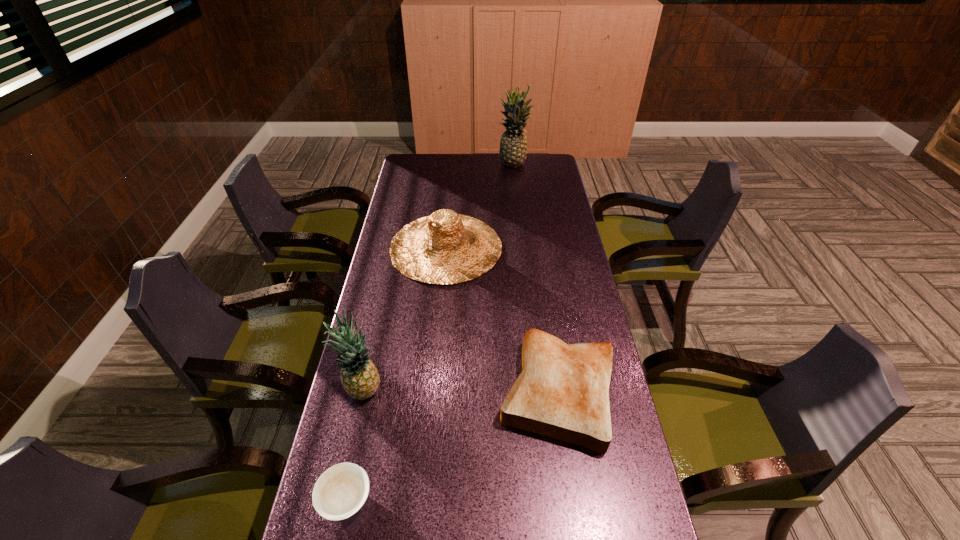
In order to click on the right pineapple in this screenshot , I will do `click(513, 146)`.

I want to click on the farther pineapple, so click(513, 146).

Locate an element on the screen. the second tallest object is located at coordinates (360, 379).

This screenshot has height=540, width=960. Find the location of `the shorter pineapple`. the shorter pineapple is located at coordinates (360, 379).

This screenshot has width=960, height=540. What are the coordinates of `the fourth nearest object` in the screenshot? It's located at (444, 248).

At what (x,y) coordinates should I click in order to perform the action: click on sunhat. Please return your answer as a coordinate pair (x, y). The height and width of the screenshot is (540, 960). Looking at the image, I should click on (444, 248).

You are a GUI agent. You are given a task and a screenshot of the screen. Output one action in this format:
    pyautogui.click(x=<x>, y=<y>)
    Task: Click on the bread
    This screenshot has width=960, height=540.
    Given the screenshot: What is the action you would take?
    pyautogui.click(x=562, y=392)

Find the location of a particular element. This screenshot has width=960, height=540. the shortest object is located at coordinates (341, 490).

Identify the location of the nearest object. (341, 490).

Find the location of a particular element. free space located 0.100m on the left of the taller pineapple is located at coordinates (476, 165).